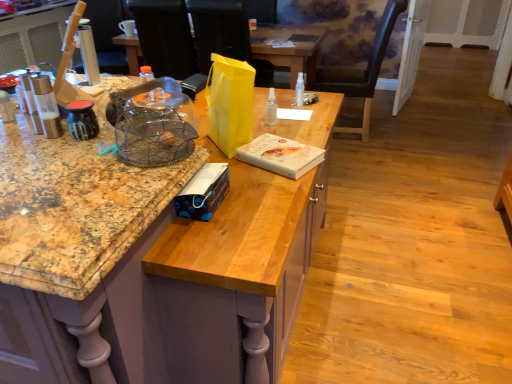
The height and width of the screenshot is (384, 512). Find the location of `blank space above white matte book at center, the 2th box from the left (from a real-world perspective)`. blank space above white matte book at center, the 2th box from the left (from a real-world perspective) is located at coordinates (282, 147).